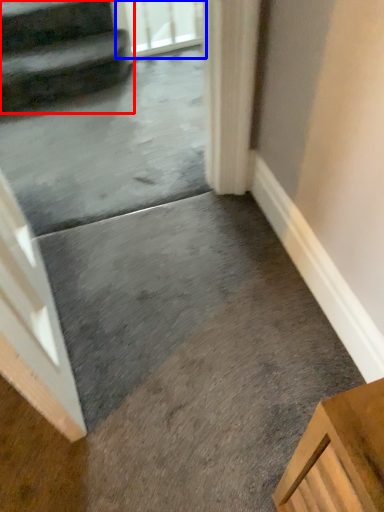
Question: Which object is closer to the camera taking this photo, stairs (highlighted by a red box) or screen door (highlighted by a blue box)?

Choices:
 (A) stairs
 (B) screen door

Answer: (A)